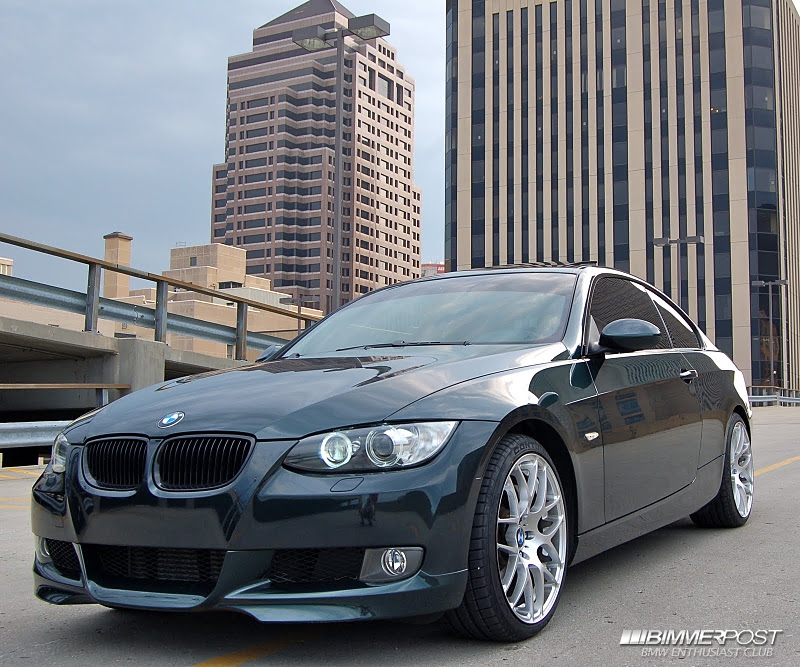
This screenshot has width=800, height=667. I want to click on window, so click(x=612, y=295), click(x=678, y=319), click(x=462, y=295).